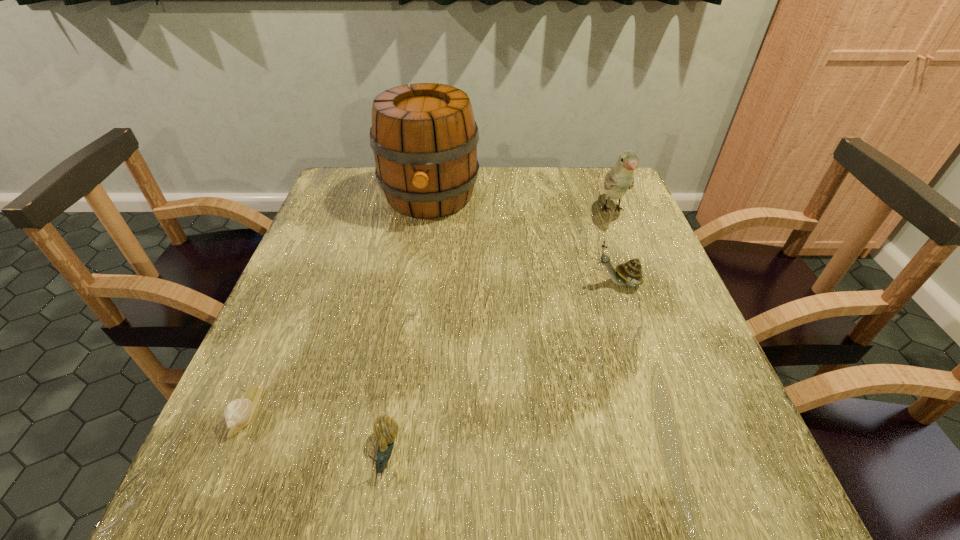
At what (x,y) coordinates should I click in order to perform the action: click on vacant space located on the face of the third farthest object. Please return your answer as a coordinate pair (x, y). This screenshot has width=960, height=540. Looking at the image, I should click on (439, 283).

Where is `vacant space situated 0.130m on the face of the third farthest object`? Image resolution: width=960 pixels, height=540 pixels. vacant space situated 0.130m on the face of the third farthest object is located at coordinates (536, 283).

You are a GUI agent. You are given a task and a screenshot of the screen. Output one action in this format:
    pyautogui.click(x=<x>, y=<y>)
    Task: Click on the free location located 0.050m on the front-facing side of the second escargot from right to left
    
    Given the screenshot: What is the action you would take?
    pyautogui.click(x=375, y=519)

Find the location of `free spot located 0.110m on the shell of the leftmost object`. free spot located 0.110m on the shell of the leftmost object is located at coordinates (205, 509).

The height and width of the screenshot is (540, 960). Identify the location of cider present at the far edge. (424, 138).

Identify the location of bird that is positioned at the far edge. This screenshot has width=960, height=540. (620, 178).

Where is `object located at the near edge`? This screenshot has width=960, height=540. object located at the near edge is located at coordinates (385, 429).

Locate an element on the screen. The width and height of the screenshot is (960, 540). cider located in the left edge section of the desktop is located at coordinates pos(424,138).

You are a GUI agent. You are given a task and a screenshot of the screen. Output one action in this format:
    pyautogui.click(x=<x>, y=<y>)
    Task: Click on the escargot that is at the left edge
    
    Given the screenshot: What is the action you would take?
    pyautogui.click(x=238, y=413)

Find the location of a particular element. bird that is at the right edge is located at coordinates (620, 178).